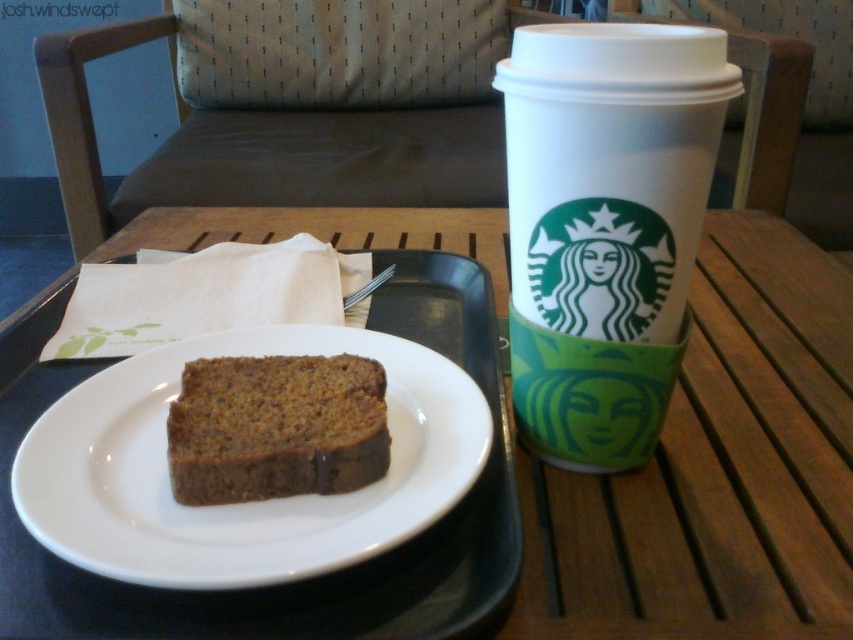
You are a customer at a cafe and want to grab both the white paper cup at upper right and the chocolatesmoothcake at center. Can you reach both items without moving your hand from their current position?

The white paper cup at upper right and chocolatesmoothcake at center are 13.25 centimeters apart. Since the average human hand span is about 18 centimeters, you can comfortably reach both items without moving your hand.

You are a customer at a cafe and want to place a small spoon on the table. You have two options for placement near the white ceramic plate at center and the chocolatesmoothcake at center. Which object should you place the spoon closer to to ensure it doesn t fall off the table?

The white ceramic plate at center is larger in size than the chocolatesmoothcake at center, so placing the spoon closer to the white ceramic plate at center provides a more stable and wider base to prevent it from falling off the table.

You are a customer at the Starbucks counter. You want to place your order for a cup of coffee. The barista hands you a receipt. Where should you place the receipt so that it doesn t fall off the tray? The tray is at point (605, 225). The options are to place it to the left or right of the white paper cup at upper right.

The receipt should be placed to the left of the white paper cup at upper right because the cup is at the upper right point, so placing it to the left would keep it stable on the tray.